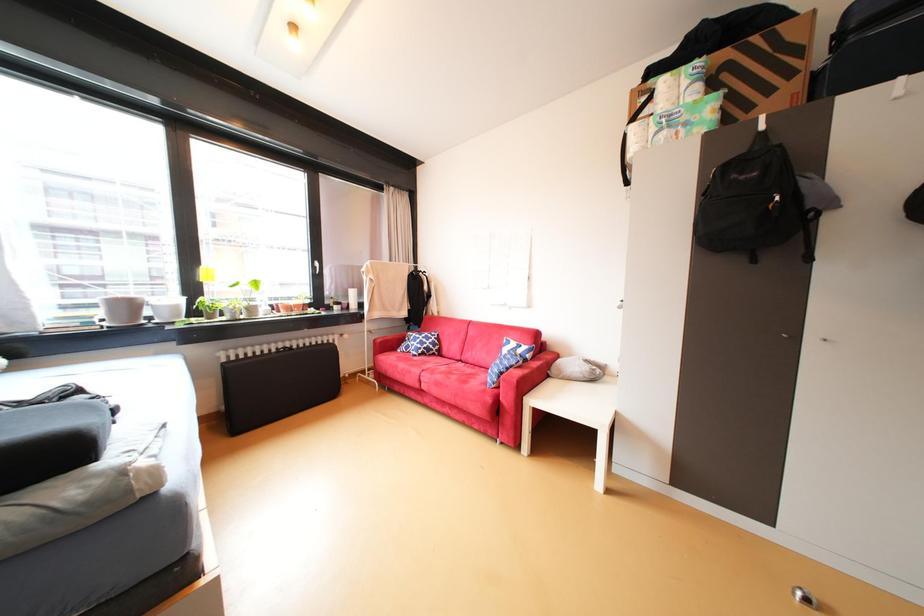
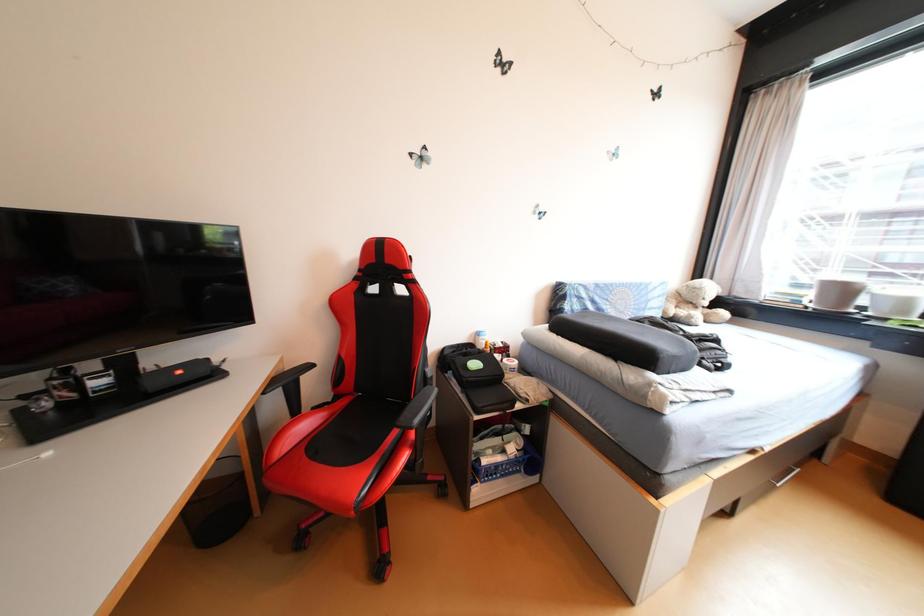
Based on the continuous images, in which direction is the camera rotating?

The camera's rotation is toward left-down.